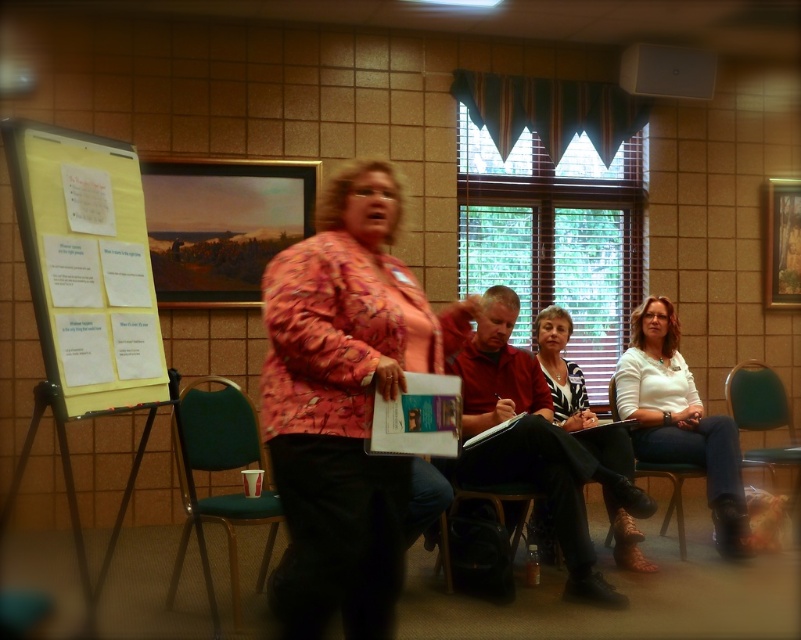
You are a photographer in this scene and want to capture a clear shot of both the white matte shirt at center and the white printed shirt at center. Since you can only focus on one subject at a time, which one should you focus on to ensure the other remains in the background?

You should focus on the white printed shirt at center because it is above the white matte shirt at center, so the matte shirt will be in the background if you focus on the printed one.